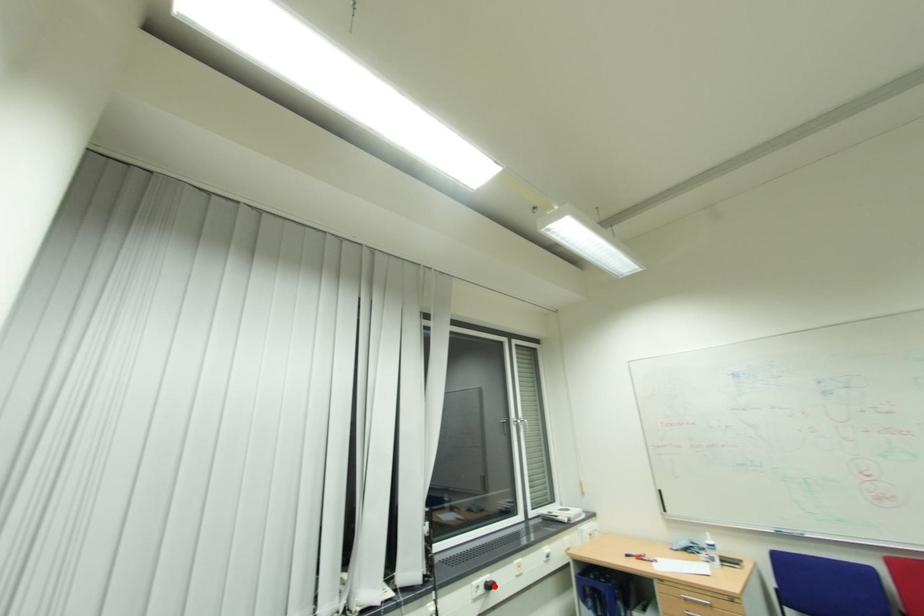
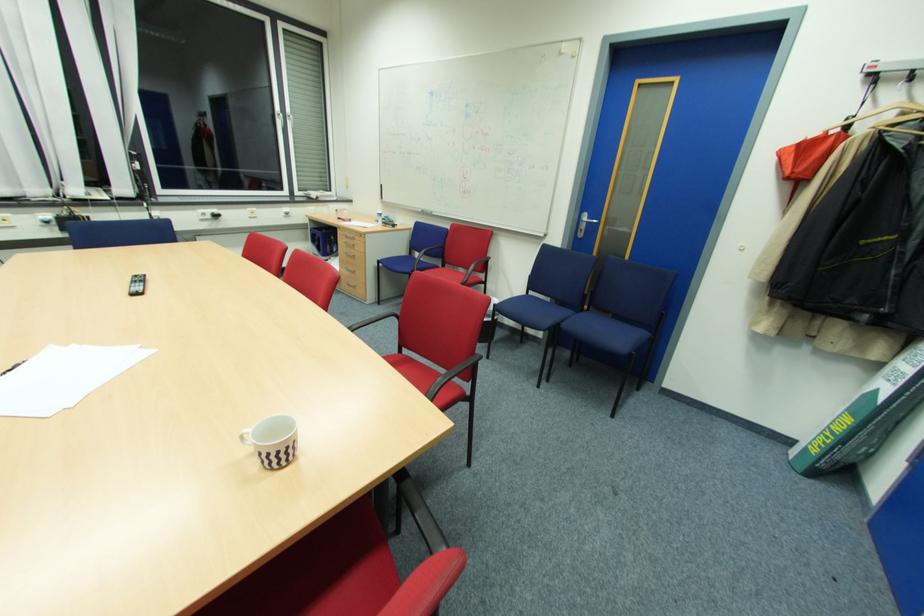
The point at the highlighted location is marked in the first image. Where is the corresponding point in the second image?

(220, 216)